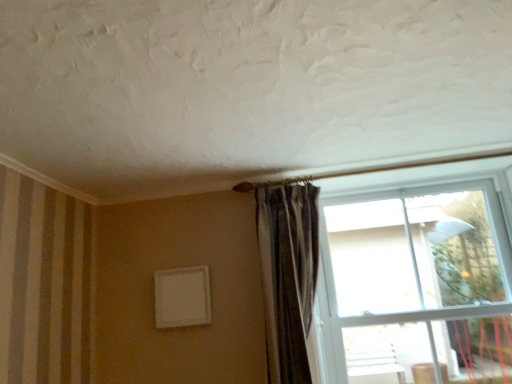
What do you see at coordinates (288, 276) in the screenshot? This screenshot has width=512, height=384. I see `striped fabric curtain at center` at bounding box center [288, 276].

Locate an element on the screen. striped fabric curtain at center is located at coordinates (288, 276).

This screenshot has height=384, width=512. Describe the element at coordinates (376, 262) in the screenshot. I see `transparent glass window at upper right` at that location.

I want to click on transparent glass window at upper right, so click(x=376, y=262).

Identify the location of striped fabric curtain at center. (288, 276).

Which object is positioned more to the right, transparent glass window at upper right or striped fabric curtain at center?

From the viewer's perspective, transparent glass window at upper right appears more on the right side.

Which is in front, transparent glass window at upper right or striped fabric curtain at center?

transparent glass window at upper right is closer to the camera.

Considering the positions of point (493, 192) and point (302, 238), is point (493, 192) closer or farther from the camera than point (302, 238)?

Point (493, 192).

From the image's perspective, does transparent glass window at upper right appear lower than striped fabric curtain at center?

Yes.

From a real-world perspective, is transparent glass window at upper right physically above striped fabric curtain at center?

Incorrect, from a real-world perspective, transparent glass window at upper right is lower than striped fabric curtain at center.

From the picture: Is transparent glass window at upper right thinner than striped fabric curtain at center?

No.

Does transparent glass window at upper right have a greater height compared to striped fabric curtain at center?

Indeed, transparent glass window at upper right has a greater height compared to striped fabric curtain at center.

Looking at this image, does transparent glass window at upper right have a larger size compared to striped fabric curtain at center?

Yes, transparent glass window at upper right is bigger than striped fabric curtain at center.

Would you say striped fabric curtain at center is part of transparent glass window at upper right's contents?

That's incorrect, striped fabric curtain at center is not inside transparent glass window at upper right.

Is transparent glass window at upper right far away from striped fabric curtain at center?

transparent glass window at upper right is near striped fabric curtain at center, not far away.

In the scene shown: Is transparent glass window at upper right turned away from striped fabric curtain at center?

That's not correct — transparent glass window at upper right is not looking away from striped fabric curtain at center.

Identify the location of window on the right side of striped fabric curtain at center. The image size is (512, 384). [x=376, y=262].

Which object is positioned more to the right, striped fabric curtain at center or transparent glass window at upper right?

Positioned to the right is transparent glass window at upper right.

Is the depth of striped fabric curtain at center greater than that of transparent glass window at upper right?

Yes, striped fabric curtain at center is behind transparent glass window at upper right.

Is point (315, 285) more distant than point (289, 217)?

No, it is in front of (289, 217).

From the image's perspective, is striped fabric curtain at center above or below transparent glass window at upper right?

striped fabric curtain at center is situated higher than transparent glass window at upper right in the image.

From a real-world perspective, is striped fabric curtain at center on top of transparent glass window at upper right?

Yes, from a real-world perspective, striped fabric curtain at center is on top of transparent glass window at upper right.

Which object is thinner, striped fabric curtain at center or transparent glass window at upper right?

With smaller width is striped fabric curtain at center.

Which of these two, striped fabric curtain at center or transparent glass window at upper right, stands shorter?

striped fabric curtain at center.

Looking at the image, does striped fabric curtain at center seem bigger or smaller compared to transparent glass window at upper right?

striped fabric curtain at center is smaller than transparent glass window at upper right.

Is striped fabric curtain at center outside of transparent glass window at upper right?

Yes, striped fabric curtain at center is outside of transparent glass window at upper right.

Is striped fabric curtain at center directly adjacent to transparent glass window at upper right?

striped fabric curtain at center and transparent glass window at upper right are not in contact.

Is striped fabric curtain at center aimed at transparent glass window at upper right?

No, striped fabric curtain at center is not facing towards transparent glass window at upper right.

Where is `window below the striped fabric curtain at center (from a real-world perspective)`? The height and width of the screenshot is (384, 512). window below the striped fabric curtain at center (from a real-world perspective) is located at coordinates (376, 262).

You are a GUI agent. You are given a task and a screenshot of the screen. Output one action in this format:
    pyautogui.click(x=<x>, y=<y>)
    Task: Click on the window located underneath the striped fabric curtain at center (from a real-world perspective)
    
    Given the screenshot: What is the action you would take?
    pos(376,262)

Where is `curtain located above the transparent glass window at upper right (from a real-world perspective)`? This screenshot has height=384, width=512. curtain located above the transparent glass window at upper right (from a real-world perspective) is located at coordinates (288, 276).